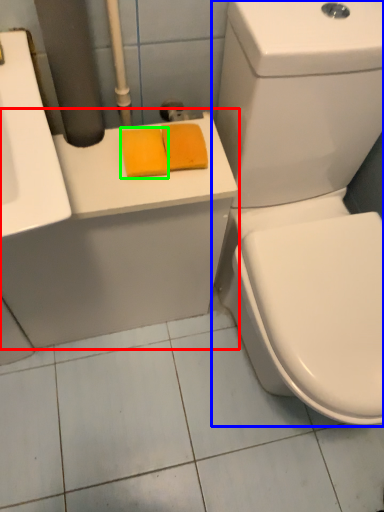
Question: Estimate the real-world distances between objects in this image. Which object is farther from counter top (highlighted by a red box), toilet (highlighted by a blue box) or soap (highlighted by a green box)?

Choices:
 (A) toilet
 (B) soap

Answer: (B)